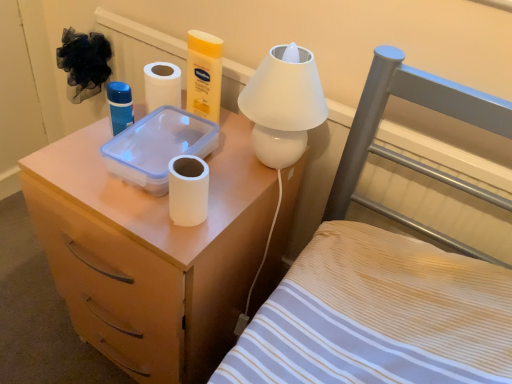
What do you see at coordinates (283, 105) in the screenshot? This screenshot has width=512, height=384. I see `white glossy table lamp at upper center` at bounding box center [283, 105].

Locate an element on the screen. The image size is (512, 384). white matte toilet paper at center is located at coordinates (188, 190).

Measure the distance between point (x=365, y=298) and camera.

Point (x=365, y=298) and camera are 29.29 inches apart from each other.

You are a GUI agent. You are given a task and a screenshot of the screen. Output one action in this format:
    pyautogui.click(x=<x>, y=<y>)
    Task: Click on the white glossy table lamp at upper center
    This screenshot has height=384, width=512.
    Given the screenshot: What is the action you would take?
    pyautogui.click(x=283, y=105)

Considering the relative sizes of white glossy table lamp at upper center and matte plastic container at upper center in the image provided, is white glossy table lamp at upper center wider than matte plastic container at upper center?

No.

Consider the image. Is white glossy table lamp at upper center facing away from matte plastic container at upper center?

No.

Considering the sizes of white glossy table lamp at upper center and matte plastic container at upper center in the image, is white glossy table lamp at upper center bigger or smaller than matte plastic container at upper center?

In the image, white glossy table lamp at upper center appears to be smaller than matte plastic container at upper center.

Is white glossy table lamp at upper center located outside matte plastic container at upper center?

Indeed, white glossy table lamp at upper center is completely outside matte plastic container at upper center.

From a real-world perspective, is matte plastic container at upper center above or below white matte toilet paper at center?

matte plastic container at upper center is below white matte toilet paper at center.

Which object is positioned more to the left, matte plastic container at upper center or white matte toilet paper at center?

From the viewer's perspective, matte plastic container at upper center appears more on the left side.

Looking at this image, who is bigger, wooden nightstand at center-left or matte plastic container at upper center?

Bigger between the two is matte plastic container at upper center.

Choose the correct answer: Is wooden nightstand at center-left inside matte plastic container at upper center or outside it?

wooden nightstand at center-left lies outside matte plastic container at upper center.

Based on the photo, considering the relative sizes of wooden nightstand at center-left and matte plastic container at upper center in the image provided, is wooden nightstand at center-left thinner than matte plastic container at upper center?

Yes.

Which object is closer to the camera, matte plastic container at upper center or white glossy table lamp at upper center?

matte plastic container at upper center is more forward.

Is matte plastic container at upper center bigger or smaller than white glossy table lamp at upper center?

In the image, matte plastic container at upper center appears to be larger than white glossy table lamp at upper center.

Is matte plastic container at upper center wider than white glossy table lamp at upper center?

Indeed, matte plastic container at upper center has a greater width compared to white glossy table lamp at upper center.

From the image's perspective, is matte plastic container at upper center on top of white glossy table lamp at upper center?

No, from the image's perspective, matte plastic container at upper center is not over white glossy table lamp at upper center.

Between point (160, 257) and point (337, 292), which one is positioned in front?

The point (160, 257) is in front.

Could you tell me if matte plastic container at upper center is turned towards wooden nightstand at center-left?

Yes.

Considering their positions, is matte plastic container at upper center located in front of or behind wooden nightstand at center-left?

Clearly, matte plastic container at upper center is in front of wooden nightstand at center-left.

Can wooden nightstand at center-left be found inside matte plastic container at upper center?

No, wooden nightstand at center-left is not surrounded by matte plastic container at upper center.

Could you tell me if white glossy table lamp at upper center is facing wooden nightstand at center-left?

No, white glossy table lamp at upper center is not oriented towards wooden nightstand at center-left.

What's the angular difference between white glossy table lamp at upper center and wooden nightstand at center-left's facing directions?

The facing directions of white glossy table lamp at upper center and wooden nightstand at center-left are 1.44 degrees apart.

From the picture: Is white glossy table lamp at upper center to the right of wooden nightstand at center-left from the viewer's perspective?

Yes.

Where is `toilet paper on the left of white glossy table lamp at upper center`? toilet paper on the left of white glossy table lamp at upper center is located at coordinates (188, 190).

Does white matte toilet paper at center have a lesser height compared to white glossy table lamp at upper center?

Yes, white matte toilet paper at center is shorter than white glossy table lamp at upper center.

Measure the distance between white matte toilet paper at center and white glossy table lamp at upper center.

A distance of 7.34 inches exists between white matte toilet paper at center and white glossy table lamp at upper center.

Which is nearer, (187, 178) or (287, 77)?

Point (187, 178) is positioned closer to the camera compared to point (287, 77).

Find the location of a particular element. The height and width of the screenshot is (384, 512). table lamp that is on the right side of matte plastic container at upper center is located at coordinates point(283,105).

Where is `nightstand in front of the white matte toilet paper at center`? The image size is (512, 384). nightstand in front of the white matte toilet paper at center is located at coordinates (151, 253).

Considering their positions, is matte plastic container at upper center positioned further to wooden nightstand at center-left than white glossy table lamp at upper center?

The object further to wooden nightstand at center-left is matte plastic container at upper center.

Considering their positions, is matte plastic container at upper center positioned further to white matte toilet paper at center than white glossy table lamp at upper center?

Based on the image, matte plastic container at upper center appears to be further to white matte toilet paper at center.

From the image, which object appears to be nearer to white glossy table lamp at upper center, white matte toilet paper at center or wooden nightstand at center-left?

Among the two, white matte toilet paper at center is located nearer to white glossy table lamp at upper center.

Looking at the image, which one is located further to white glossy table lamp at upper center, wooden nightstand at center-left or matte plastic container at upper center?

Based on the image, matte plastic container at upper center appears to be further to white glossy table lamp at upper center.

When comparing their distances from matte plastic container at upper center, does wooden nightstand at center-left or white matte toilet paper at center seem further?

wooden nightstand at center-left lies further to matte plastic container at upper center than the other object.

In the scene shown: When comparing their distances from wooden nightstand at center-left, does white glossy table lamp at upper center or matte plastic container at upper center seem closer?

Based on the image, white glossy table lamp at upper center appears to be nearer to wooden nightstand at center-left.

Looking at the image, which one is located closer to white matte toilet paper at center, white glossy table lamp at upper center or wooden nightstand at center-left?

white glossy table lamp at upper center lies closer to white matte toilet paper at center than the other object.

When comparing their distances from wooden nightstand at center-left, does white matte toilet paper at center or matte plastic container at upper center seem closer?

matte plastic container at upper center is closer to wooden nightstand at center-left.

Locate an element on the screen. furniture between white glossy table lamp at upper center and matte plastic container at upper center vertically is located at coordinates (385, 275).

Where is `toilet paper between white glossy table lamp at upper center and matte plastic container at upper center vertically`? The height and width of the screenshot is (384, 512). toilet paper between white glossy table lamp at upper center and matte plastic container at upper center vertically is located at coordinates (x=188, y=190).

At what (x,y) coordinates should I click in order to perform the action: click on furniture between white glossy table lamp at upper center and white matte toilet paper at center from top to bottom. Please return your answer as a coordinate pair (x, y). This screenshot has height=384, width=512. Looking at the image, I should click on (385, 275).

Find the location of a particular element. Image resolution: width=512 pixels, height=384 pixels. toilet paper between matte plastic container at upper center and wooden nightstand at center-left is located at coordinates (188, 190).